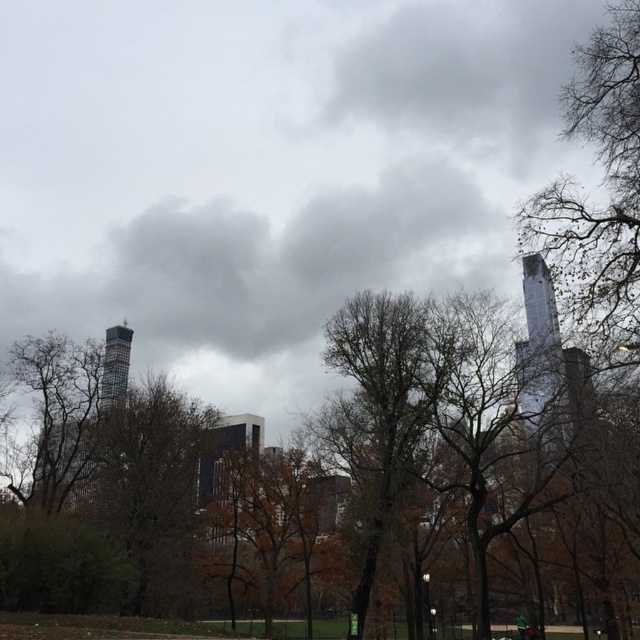
You are standing in a park and see the bare branches at right and the glassy reflective skyscraper at center. Which object appears bigger in the image?

The bare branches at right appears larger in size than the glassy reflective skyscraper at center.

You are standing in the scene and want to locate the bare branches at right. According to the coordinates provided, where would you look to find them?

The bare branches at right are located at coordinates point (598, 204).

You are standing in a park with a cloudy sky above. You see a point marked at coordinates (598, 204). Based on the scene description, where is this point located?

The point is on the bare branches at the right side of the image.